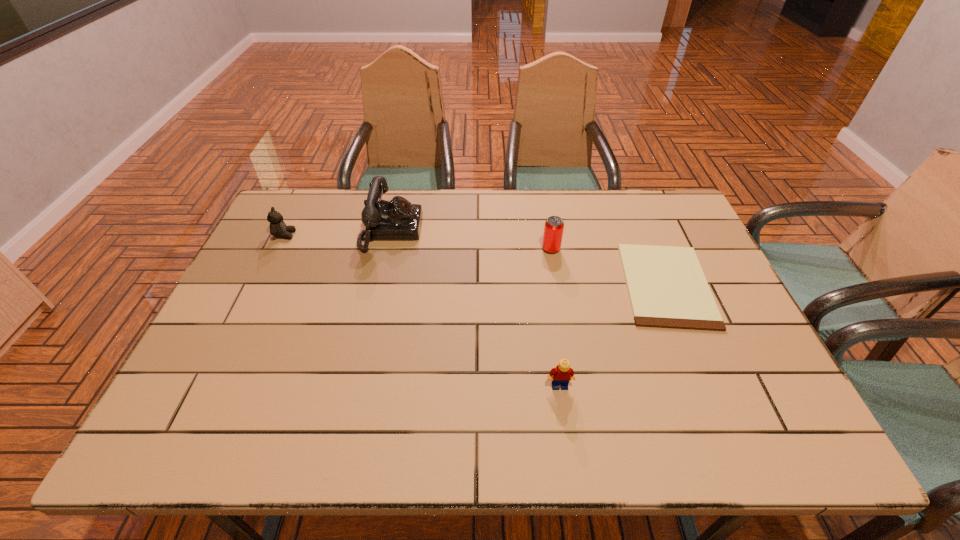
Image resolution: width=960 pixels, height=540 pixels. Find the location of `vacant point that satisfies the following two spatial constraints: 1. on the dial of the fourth object from right to left; 2. on the back side of the can`. vacant point that satisfies the following two spatial constraints: 1. on the dial of the fourth object from right to left; 2. on the back side of the can is located at coordinates (387, 249).

Where is `free location that satisfies the following two spatial constraints: 1. on the face of the leftmost object; 2. on the back side of the can`? This screenshot has width=960, height=540. free location that satisfies the following two spatial constraints: 1. on the face of the leftmost object; 2. on the back side of the can is located at coordinates (278, 249).

Image resolution: width=960 pixels, height=540 pixels. In order to click on free space that satisfies the following two spatial constraints: 1. on the dial of the tallest object; 2. on the back side of the can in this screenshot , I will do `click(387, 249)`.

Find the location of a particular element. This screenshot has height=540, width=960. free point that satisfies the following two spatial constraints: 1. on the dial of the telephone; 2. on the back side of the clipboard is located at coordinates (379, 285).

Find the location of a particular element. The height and width of the screenshot is (540, 960). free space that satisfies the following two spatial constraints: 1. on the face of the shortest object; 2. on the left side of the leftmost object is located at coordinates (261, 285).